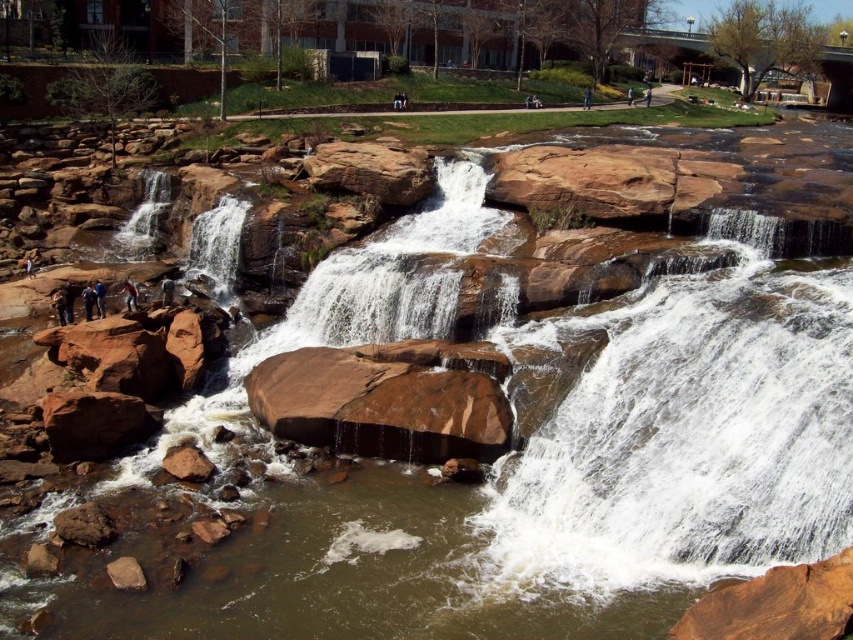
You are a photographer standing at the base of the waterfall. You see the dark brown leather jacket at lower left and the blue denim jeans at lower left. Which item is positioned closer to you?

The dark brown leather jacket at lower left is closer to the viewer than the blue denim jeans at lower left, so the jacket is positioned closer to you.

You are standing at the base of the white smooth waterfall at left and want to reach the dark brown leather jacket at left. Which direction should you move to get closer to the jacket?

You should move away from the white smooth waterfall at left because it is closer to you than the dark brown leather jacket at left, so moving away from the waterfall will bring you closer to the jacket.